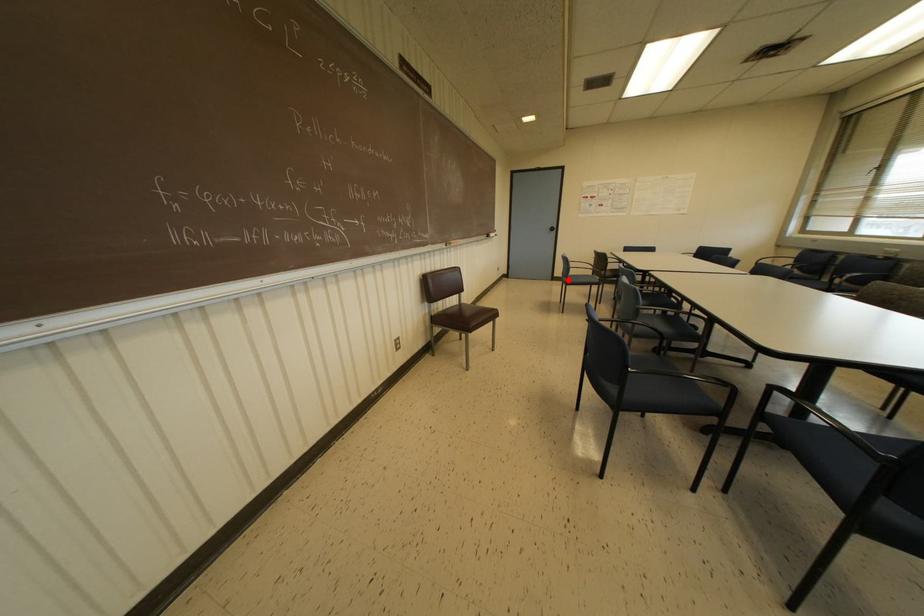
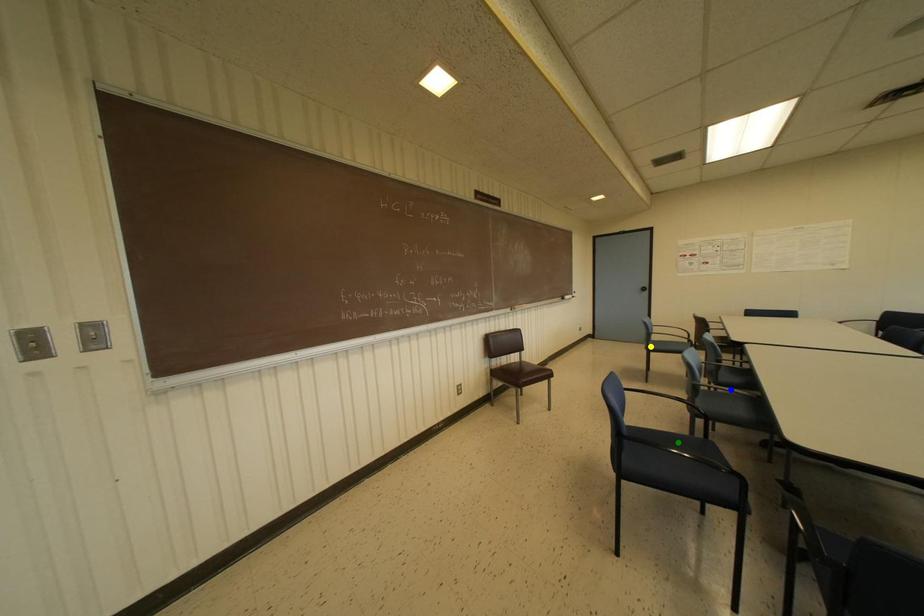
Question: I am providing you with two images of the same scene from different viewpoints. A red point is marked on the first image. You are given multiple points on the second image. Which point in image 2 represents the same 3d spot as the red point in image 1?

Choices:
 (A) yellow point
 (B) green point
 (C) blue point

Answer: (A)